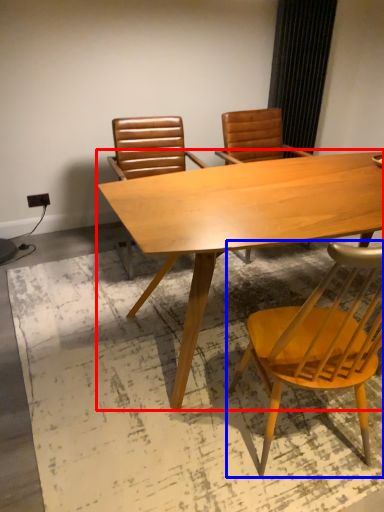
Question: Which object is further to the camera taking this photo, table (highlighted by a red box) or chair (highlighted by a blue box)?

Choices:
 (A) table
 (B) chair

Answer: (A)